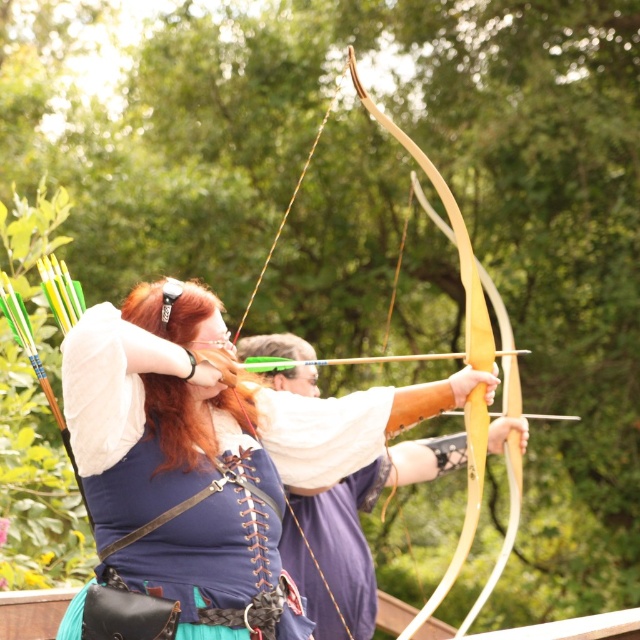
Question: Is matte blue shirt at center below natural wood bow at center?

Choices:
 (A) yes
 (B) no

Answer: (A)

Question: Which object is closer to the camera taking this photo?

Choices:
 (A) natural wood bow at center
 (B) matte blue shirt at center

Answer: (B)

Question: Is matte blue shirt at center thinner than natural wood bow at center?

Choices:
 (A) no
 (B) yes

Answer: (A)

Question: Among these points, which one is farthest from the camera?

Choices:
 (A) (348, 68)
 (B) (275, 394)

Answer: (B)

Question: Is matte blue shirt at center to the left of natural wood bow at center from the viewer's perspective?

Choices:
 (A) no
 (B) yes

Answer: (B)